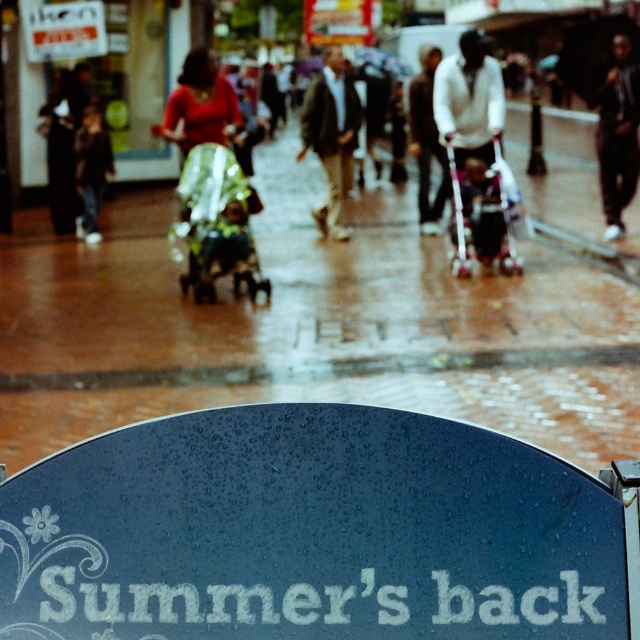
You are standing at the point with coordinates point (605,225) and want to walk to the point with coordinates point (196,234). Are you moving towards the circular sign or away from it?

Point (196,234) is in front of point (605,225), so moving from point (605,225) to point (196,234) means you are moving towards the circular sign.

You are a delivery person standing in the rain and see the dark blue textured sign at lower center and the dark brown leather jacket at center. Which object is taller?

The dark brown leather jacket at center is taller than the dark blue textured sign at lower center.

You are a fashion designer observing the urban scene. You notice two sweaters in the image. The white sweater at center and the dark gray sweater at center. How far apart are these two sweaters?

The white sweater at center is 32.23 inches from the dark gray sweater at center.